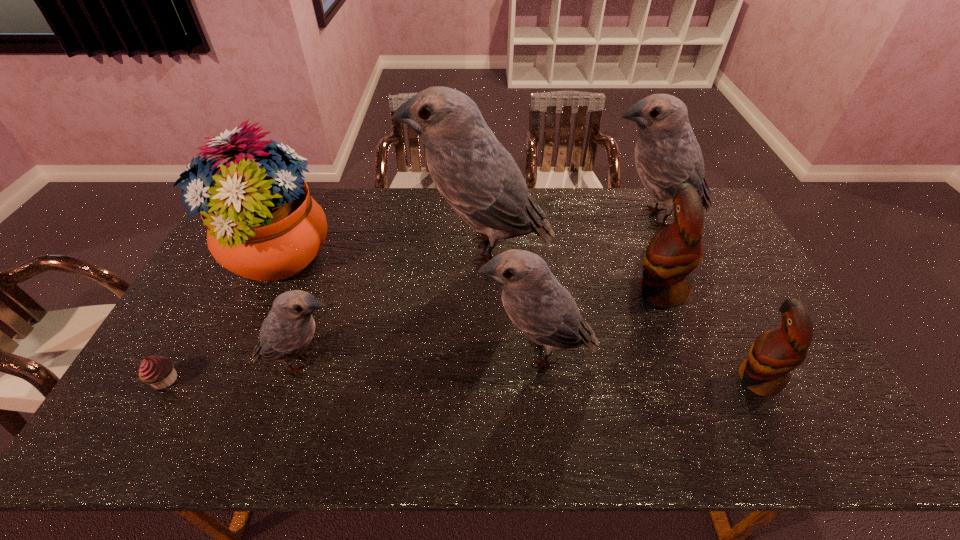
Locate an element on the screen. vacant space located on the right of the flower arrangement is located at coordinates (363, 258).

Where is `vacant space located 0.340m on the face of the farther red parrot`? The image size is (960, 540). vacant space located 0.340m on the face of the farther red parrot is located at coordinates (519, 292).

I want to click on free region located 0.220m on the face of the farther red parrot, so click(560, 292).

The image size is (960, 540). I want to click on free space located on the face of the farther red parrot, so click(563, 292).

Locate an element on the screen. free space located on the front-facing side of the third biggest gray parrot is located at coordinates (448, 353).

This screenshot has height=540, width=960. Identify the location of vacant region located on the front-facing side of the third biggest gray parrot. (373, 353).

Locate an element on the screen. This screenshot has width=960, height=540. vacant space positioned on the front-facing side of the third biggest gray parrot is located at coordinates (441, 353).

Locate an element on the screen. This screenshot has width=960, height=540. blank space located 0.070m on the front-facing side of the smallest gray parrot is located at coordinates (373, 363).

Locate an element on the screen. The image size is (960, 540). vacant region located on the face of the right red parrot is located at coordinates (682, 379).

You are a GUI agent. You are given a task and a screenshot of the screen. Output one action in this format:
    pyautogui.click(x=<x>, y=<y>)
    Task: Click on the free space located on the face of the right red parrot
    
    Given the screenshot: What is the action you would take?
    pyautogui.click(x=631, y=379)